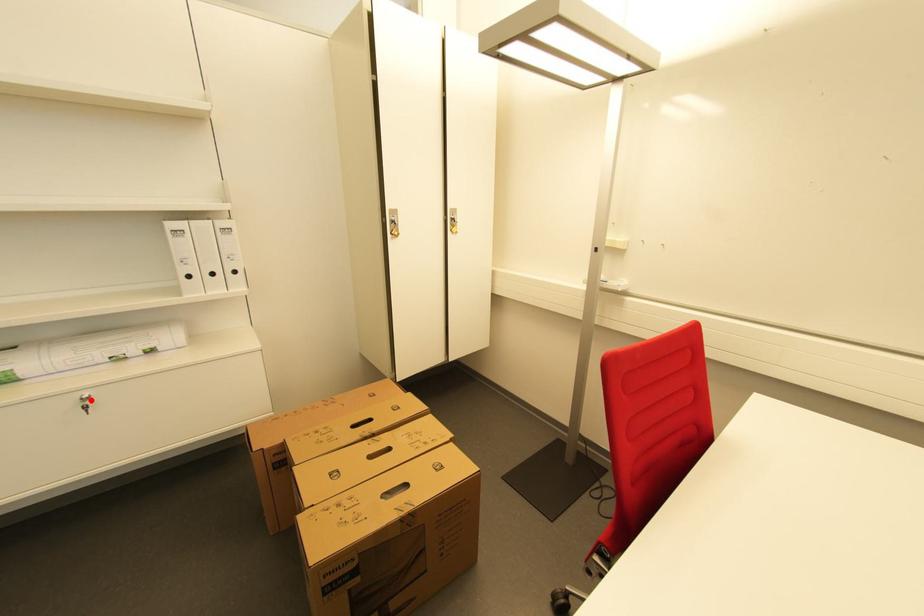
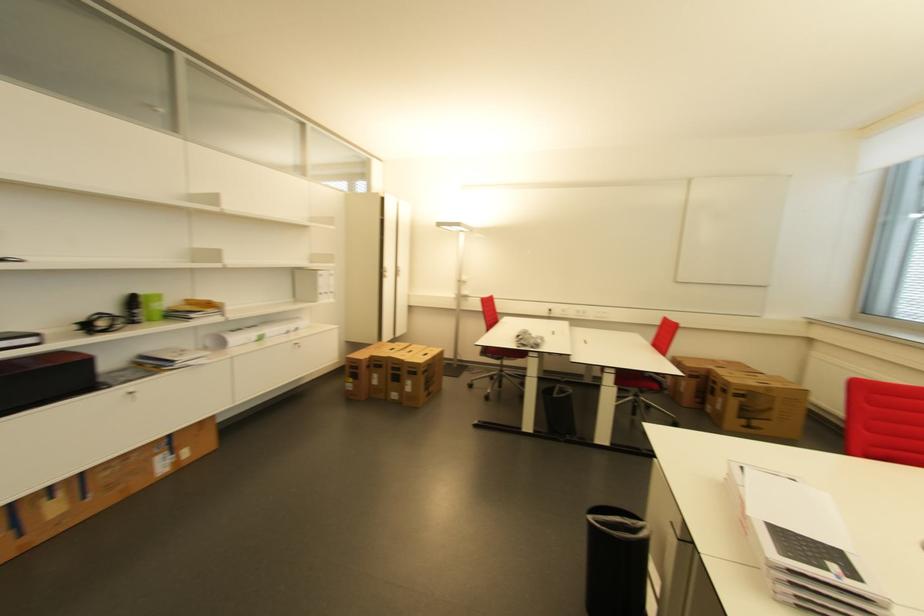
In the second image, find the point that corresponds to the highlighted location in the first image.

(300, 345)